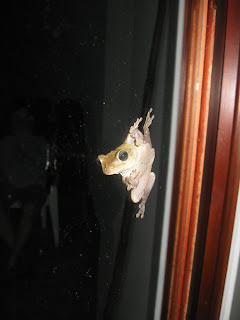
This screenshot has width=240, height=320. I want to click on window frame, so click(x=166, y=193).